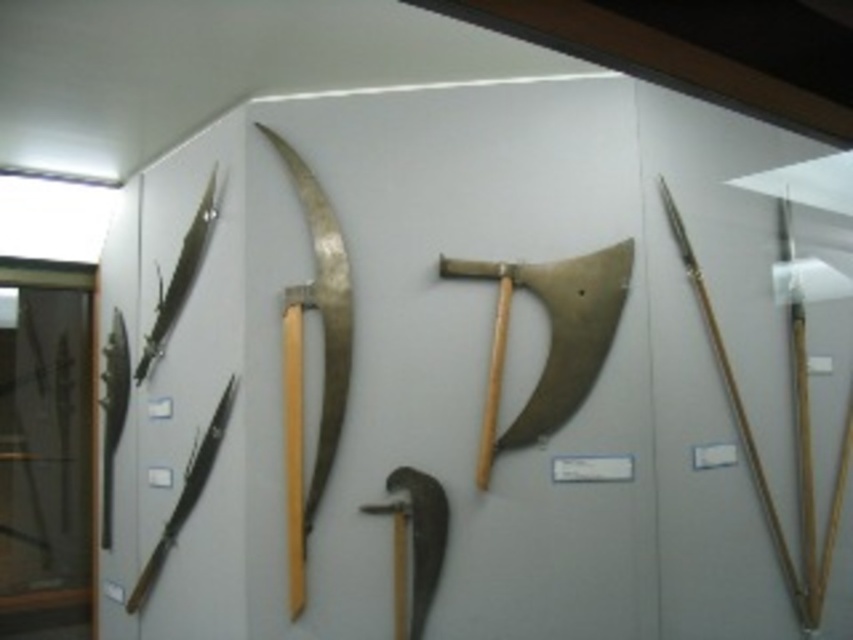
Based on the photo, which object is located at the coordinates point (550, 337)?

The gold metallic axe at center is located at point (550, 337).

You are a visitor standing in front of the ancient weapons display. You notice the polished silver scythe at center and the shiny metallic spear at left. Which weapon is positioned closer to you?

The polished silver scythe at center is closer to the viewer than the shiny metallic spear at left.